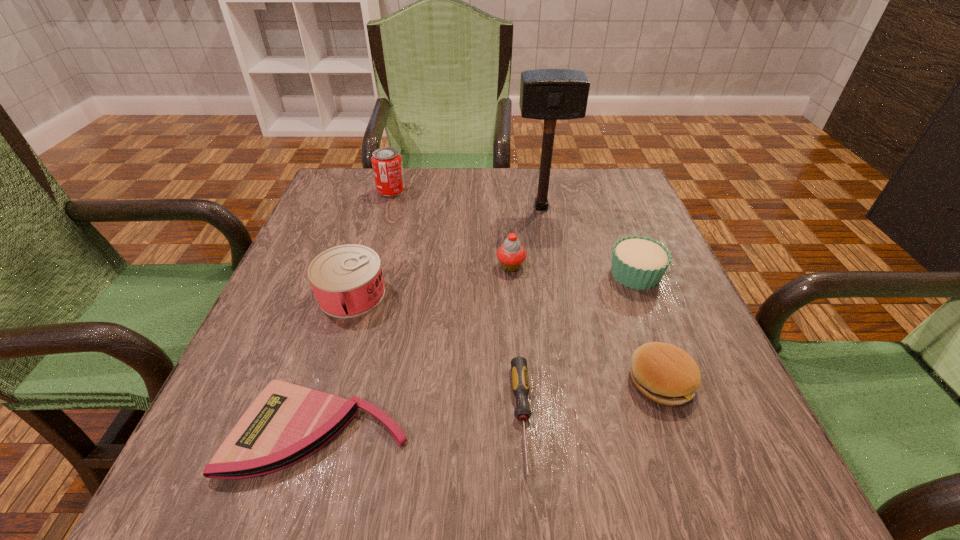
Identify the location of vacant space that's between the shorter can and the screwdriver. The image size is (960, 540). (437, 356).

What are the coordinates of `the closest object relative to the patty` in the screenshot? It's located at (638, 262).

Locate which object is the third closest to the seventh nearest object. Please provide its 2D coordinates. Your answer should be formatted as a tuple, i.e. [(x, y)], where the tuple contains the x and y coordinates of a point satisfying the conditions above.

[(387, 165)]

Find the location of a particular element. Image resolution: width=960 pixels, height=540 pixels. free space that satisfies the following two spatial constraints: 1. on the back side of the nearer can; 2. on the left side of the taller cupcake is located at coordinates (360, 266).

You are a GUI agent. You are given a task and a screenshot of the screen. Output one action in this format:
    pyautogui.click(x=<x>, y=<y>)
    Task: Click on the free space that satisfies the following two spatial constraints: 1. on the back side of the left cupcake; 2. on the right side of the mallet
    The height and width of the screenshot is (540, 960).
    Given the screenshot: What is the action you would take?
    pyautogui.click(x=506, y=207)

Find the location of a particular element. The height and width of the screenshot is (540, 960). vacant region that satisfies the following two spatial constraints: 1. on the front side of the left cupcake; 2. on the right side of the patty is located at coordinates (520, 381).